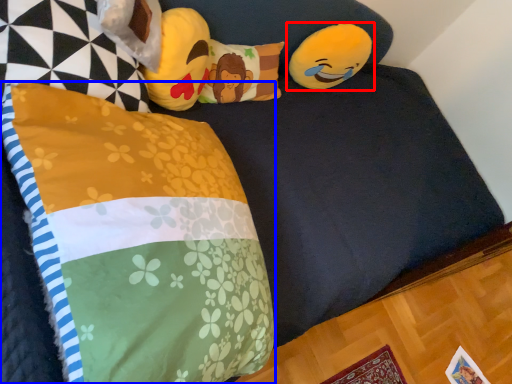
Question: Among these objects, which one is farthest to the camera, toy (highlighted by a red box) or pillow (highlighted by a blue box)?

Choices:
 (A) toy
 (B) pillow

Answer: (A)